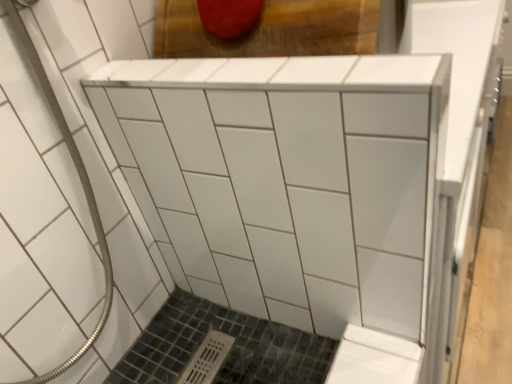
Identify the location of white glossy tile at center. (68, 196).

The height and width of the screenshot is (384, 512). What do you see at coordinates (68, 196) in the screenshot? I see `white glossy tile at center` at bounding box center [68, 196].

The height and width of the screenshot is (384, 512). Find the location of `white glossy cabinet at center`. white glossy cabinet at center is located at coordinates (290, 181).

The width and height of the screenshot is (512, 384). What do you see at coordinates (290, 181) in the screenshot?
I see `white glossy cabinet at center` at bounding box center [290, 181].

The image size is (512, 384). I want to click on white glossy tile at center, so click(68, 196).

Based on their positions, is white glossy cabinet at center located to the left or right of white glossy tile at center?

From the image, it's evident that white glossy cabinet at center is to the right of white glossy tile at center.

In the image, is white glossy cabinet at center positioned in front of or behind white glossy tile at center?

Clearly, white glossy cabinet at center is behind white glossy tile at center.

Between point (261, 201) and point (48, 218), which one is positioned behind?

Positioned behind is point (261, 201).

From the image's perspective, which is above, white glossy cabinet at center or white glossy tile at center?

white glossy cabinet at center, from the image's perspective.

From a real-world perspective, between white glossy cabinet at center and white glossy tile at center, who is vertically lower?

white glossy cabinet at center.

Can you confirm if white glossy cabinet at center is wider than white glossy tile at center?

No.

Considering the sizes of objects white glossy cabinet at center and white glossy tile at center in the image provided, who is taller, white glossy cabinet at center or white glossy tile at center?

white glossy tile at center.

Who is bigger, white glossy cabinet at center or white glossy tile at center?

With larger size is white glossy tile at center.

Would you say white glossy cabinet at center is inside or outside white glossy tile at center?

white glossy cabinet at center exists outside the volume of white glossy tile at center.

Is white glossy cabinet at center beside white glossy tile at center?

No, white glossy cabinet at center is not touching white glossy tile at center.

Is white glossy tile at center at the back of white glossy cabinet at center?

No, white glossy tile at center is not at the back of white glossy cabinet at center.

The width and height of the screenshot is (512, 384). Find the location of `bath that appears below the white glossy cabinet at center (from the image's perspective)`. bath that appears below the white glossy cabinet at center (from the image's perspective) is located at coordinates (68, 196).

Which object is positioned more to the left, white glossy tile at center or white glossy cabinet at center?

Positioned to the left is white glossy tile at center.

Consider the image. Considering the positions of objects white glossy tile at center and white glossy cabinet at center in the image provided, who is behind, white glossy tile at center or white glossy cabinet at center?

white glossy cabinet at center is more distant.

Which point is more distant from viewer, (18, 160) or (174, 207)?

The point (174, 207) is behind.

From the image's perspective, is white glossy tile at center over white glossy cabinet at center?

Incorrect, from the image's perspective, white glossy tile at center is lower than white glossy cabinet at center.

From a real-world perspective, which is physically below, white glossy tile at center or white glossy cabinet at center?

white glossy cabinet at center is physically lower.

Looking at their sizes, would you say white glossy tile at center is wider or thinner than white glossy cabinet at center?

white glossy tile at center is wider than white glossy cabinet at center.

Is white glossy tile at center taller or shorter than white glossy cabinet at center?

Considering their sizes, white glossy tile at center has more height than white glossy cabinet at center.

Considering the sizes of objects white glossy tile at center and white glossy cabinet at center in the image provided, who is smaller, white glossy tile at center or white glossy cabinet at center?

white glossy cabinet at center.

Does white glossy tile at center contain white glossy cabinet at center?

Actually, white glossy cabinet at center is outside white glossy tile at center.

Is white glossy tile at center positioned far away from white glossy cabinet at center?

No, white glossy tile at center is not far away from white glossy cabinet at center.

Does white glossy tile at center turn towards white glossy cabinet at center?

No, white glossy tile at center is not facing towards white glossy cabinet at center.

At what (x,y) coordinates should I click in order to perform the action: click on furniture above the white glossy tile at center (from the image's perspective). Please return your answer as a coordinate pair (x, y). Looking at the image, I should click on (290, 181).

Find the location of a particular element. bath below the white glossy cabinet at center (from the image's perspective) is located at coordinates (68, 196).

The height and width of the screenshot is (384, 512). Find the location of `bath positioned vertically above the white glossy cabinet at center (from a real-world perspective)`. bath positioned vertically above the white glossy cabinet at center (from a real-world perspective) is located at coordinates (68, 196).